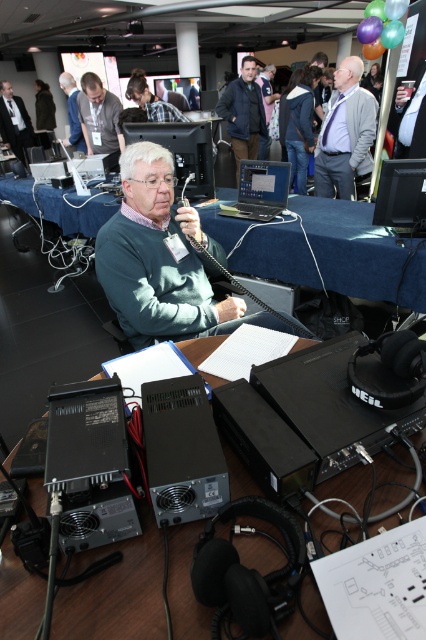
Does black plastic table at center have a smaller size compared to denim jacket at upper center?

Yes, black plastic table at center is smaller than denim jacket at upper center.

Who is taller, black plastic table at center or denim jacket at upper center?

denim jacket at upper center

Which is behind, point (405, 470) or point (307, 120)?

The point (307, 120) is more distant.

Where is `black plastic table at center`? This screenshot has height=640, width=426. black plastic table at center is located at coordinates (115, 592).

In the scene shown: Does matte black monitor at center have a lesser height compared to dark blue jacket at center?

Yes, matte black monitor at center is shorter than dark blue jacket at center.

Is point (414, 205) more distant than point (249, 150)?

No.

This screenshot has height=640, width=426. Identify the location of matte black monitor at center. (402, 195).

Measure the distance between point (351, 156) and camera.

Point (351, 156) is 4.22 meters away from camera.

Does gray fabric tie at upper center have a greater width compared to denim jacket at upper center?

Indeed, gray fabric tie at upper center has a greater width compared to denim jacket at upper center.

Is point (345, 132) positioned after point (301, 113)?

No, it is not.

Where is `gray fabric tie at upper center`? This screenshot has width=426, height=640. gray fabric tie at upper center is located at coordinates (345, 132).